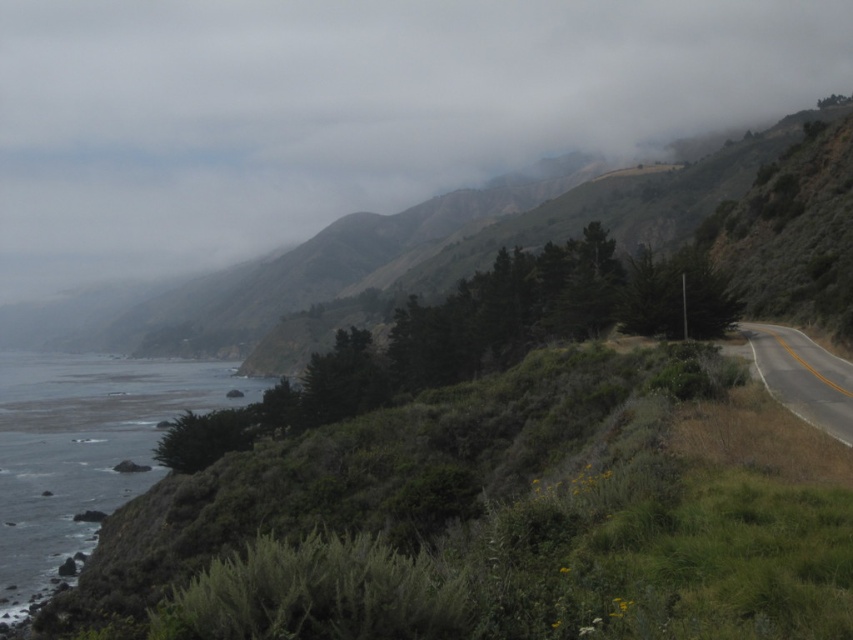
Question: Estimate the real-world distances between objects in this image. Which object is farther from the foggy misty hillside at upper center?

Choices:
 (A) greenish-blue water at lower left
 (B) asphalt road at right

Answer: (B)

Question: Can you confirm if greenish-blue water at lower left is bigger than asphalt road at right?

Choices:
 (A) no
 (B) yes

Answer: (B)

Question: Can you confirm if foggy misty hillside at upper center is positioned below asphalt road at right?

Choices:
 (A) no
 (B) yes

Answer: (A)

Question: Which object appears closest to the camera in this image?

Choices:
 (A) asphalt road at right
 (B) foggy misty hillside at upper center
 (C) greenish-blue water at lower left

Answer: (A)

Question: Which object is positioned closest to the foggy misty hillside at upper center?

Choices:
 (A) greenish-blue water at lower left
 (B) asphalt road at right

Answer: (A)

Question: Is foggy misty hillside at upper center to the right of greenish-blue water at lower left from the viewer's perspective?

Choices:
 (A) yes
 (B) no

Answer: (A)